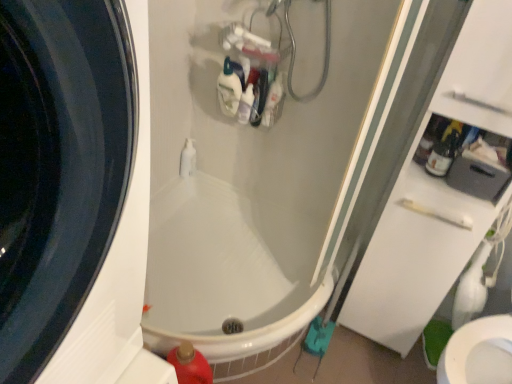
Question: Which direction should I rotate to look at translucent plastic bottle at upper center, which appears as the 1th cleaning product when viewed from the top, — up or down?

Choices:
 (A) up
 (B) down

Answer: (A)

Question: Is translucent plastic bottle at upper right directly adjacent to white glossy pump bottle at center?

Choices:
 (A) yes
 (B) no

Answer: (B)

Question: Would you say translucent plastic bottle at upper right is a long distance from white glossy pump bottle at center?

Choices:
 (A) no
 (B) yes

Answer: (B)

Question: From the image's perspective, does translucent plastic bottle at upper right appear higher than white glossy pump bottle at center?

Choices:
 (A) no
 (B) yes

Answer: (A)

Question: Is translucent plastic bottle at upper right smaller than white glossy pump bottle at center?

Choices:
 (A) yes
 (B) no

Answer: (A)

Question: Is white glossy pump bottle at center located within translucent plastic bottle at upper right?

Choices:
 (A) no
 (B) yes

Answer: (A)

Question: Does translucent plastic bottle at upper right have a greater height compared to white glossy pump bottle at center?

Choices:
 (A) no
 (B) yes

Answer: (A)

Question: Is white glossy bottle at upper center, the 2th cleaning product in the bottom-to-top sequence, placed right next to white glossy pump bottle at center?

Choices:
 (A) no
 (B) yes

Answer: (A)

Question: Is white glossy bottle at upper center, arranged as the 2th cleaning product when viewed from the top, taller than white glossy pump bottle at center?

Choices:
 (A) no
 (B) yes

Answer: (A)

Question: Is white glossy bottle at upper center, arranged as the 2th cleaning product when viewed from the top, to the left of white glossy pump bottle at center from the viewer's perspective?

Choices:
 (A) yes
 (B) no

Answer: (B)

Question: Is white glossy bottle at upper center, the 2th cleaning product in the bottom-to-top sequence, wider than white glossy pump bottle at center?

Choices:
 (A) yes
 (B) no

Answer: (B)

Question: Can we say white glossy bottle at upper center, arranged as the 2th cleaning product when viewed from the top, lies outside white glossy pump bottle at center?

Choices:
 (A) no
 (B) yes

Answer: (B)

Question: Can you confirm if white glossy bottle at upper center, the 2th cleaning product in the bottom-to-top sequence, is thinner than white glossy pump bottle at center?

Choices:
 (A) no
 (B) yes

Answer: (B)

Question: Is white glossy bottle at upper center, positioned as the second cleaning product in back-to-front order, closer to camera compared to translucent plastic bottle at upper center, the 3th cleaning product positioned from the bottom?

Choices:
 (A) no
 (B) yes

Answer: (B)